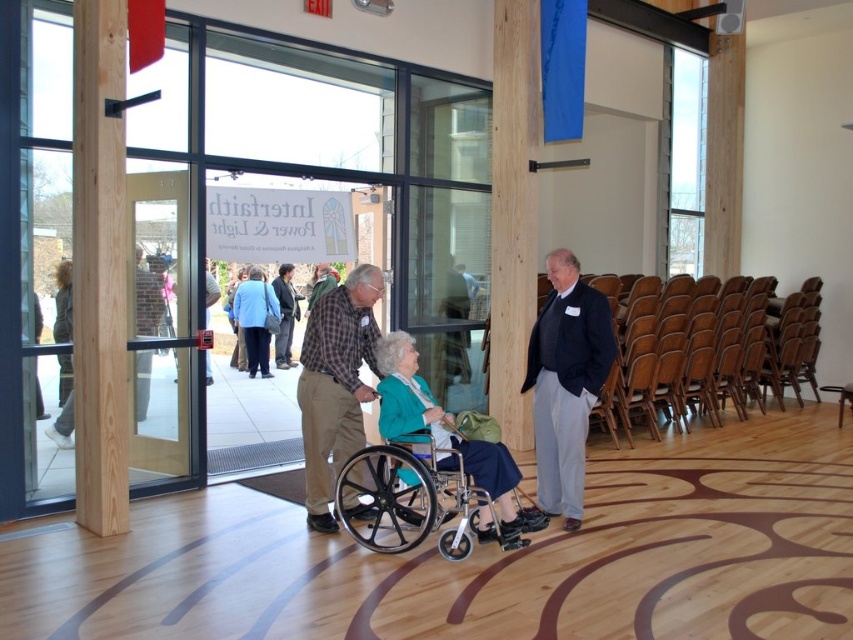
You are standing at the point marked as point (503,340) and want to reach the glass door. The door is 23.55 feet away from your current position. If you walk straight towards the door, will you pass by the wheelchair user?

The distance between you and the door is 23.55 feet. Since the wheelchair user is located at your current position, moving straight towards the door would not require passing by them as they are already at the starting point.

You are standing in the modern building shown in the image. You need to locate the wooden pillar at center. Where exactly is it positioned in the scene?

The wooden pillar at center is located at point coordinates of (514, 211).

You are navigating through the room and need to reach the point at coordinates (329, 531). There is an obstacle at point (529, 280). Will you encounter this obstacle before reaching your destination?

Yes, you will encounter the obstacle at point (529, 280) before reaching the destination at (329, 531) because the obstacle is closer to your current position.